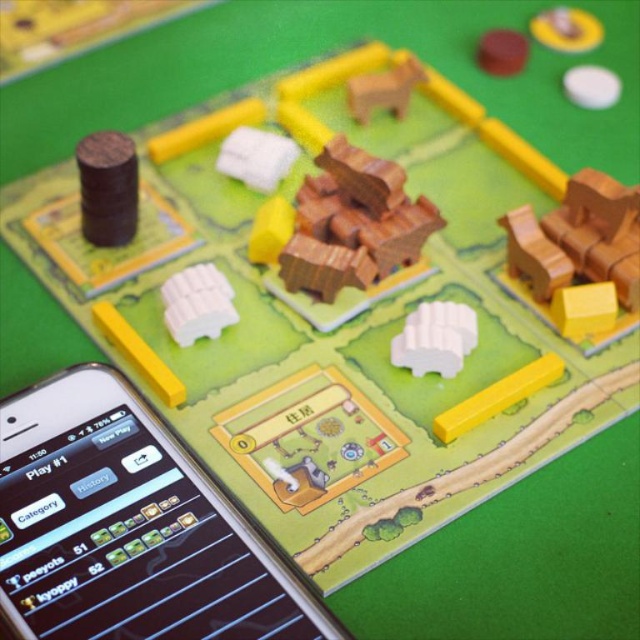
Is point (92, 189) positioned before point (419, 364)?

No, it is behind (419, 364).

Does dark brown wood cylinder at left have a larger size compared to white matte gear at center?

Yes, dark brown wood cylinder at left is bigger than white matte gear at center.

Who is more forward, (132, 182) or (458, 316)?

Positioned in front is point (458, 316).

At what (x,y) coordinates should I click in order to perform the action: click on dark brown wood cylinder at left. Please return your answer as a coordinate pair (x, y). Looking at the image, I should click on (108, 188).

Does white matte gear at center have a lesser width compared to wooden horse at upper center?

Indeed, white matte gear at center has a lesser width compared to wooden horse at upper center.

Can you confirm if white matte gear at center is shorter than wooden horse at upper center?

Yes.

Who is more distant from viewer, (452, 349) or (360, 120)?

Positioned behind is point (360, 120).

At what (x,y) coordinates should I click in order to perform the action: click on white matte gear at center. Please return your answer as a coordinate pair (x, y). The height and width of the screenshot is (640, 640). Looking at the image, I should click on (435, 339).

Can you confirm if wooden house at center is taller than dark brown wood cylinder at left?

Correct, wooden house at center is much taller as dark brown wood cylinder at left.

Between wooden house at center and dark brown wood cylinder at left, which one has less height?

dark brown wood cylinder at left is shorter.

Where is `wooden house at center`? wooden house at center is located at coordinates (353, 224).